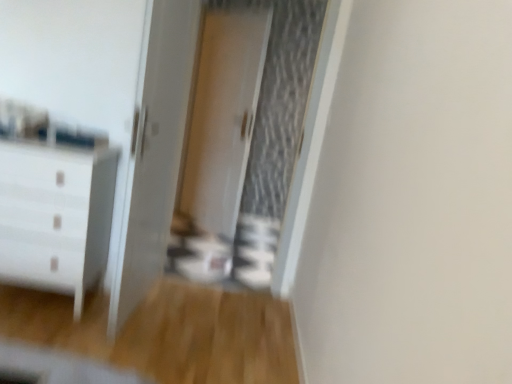
Describe the element at coordinates (245, 140) in the screenshot. I see `white glossy screen door at center, the first screen door in the front-to-back sequence` at that location.

What do you see at coordinates (55, 217) in the screenshot? I see `white glossy chest of drawers at left` at bounding box center [55, 217].

This screenshot has height=384, width=512. What are the coordinates of `white glossy door at center` in the screenshot? It's located at (152, 154).

In order to face white glossy door at center, the first screen door positioned from the back, should I rotate leftwards or rightwards?

You should rotate left by 5.209 degrees.

This screenshot has width=512, height=384. What are the coordinates of `white glossy screen door at center, the first screen door in the front-to-back sequence` in the screenshot? It's located at (245, 140).

Based on the photo, is white glossy chest of drawers at left in front of white glossy door at center?

No.

Does white glossy chest of drawers at left turn towards white glossy door at center?

No, white glossy chest of drawers at left is not turned towards white glossy door at center.

Can you confirm if white glossy chest of drawers at left is bigger than white glossy door at center?

Yes.

From the image's perspective, does white glossy chest of drawers at left appear higher than white glossy door at center?

Incorrect, from the image's perspective, white glossy chest of drawers at left is lower than white glossy door at center.

Can you see white glossy door at center touching white glossy door at center, the 2th screen door viewed from the front?

No, white glossy door at center is not touching white glossy door at center, the 2th screen door viewed from the front.

From a real-world perspective, is white glossy door at center physically above white glossy door at center, the first screen door positioned from the back?

No, from a real-world perspective, white glossy door at center is not over white glossy door at center, the first screen door positioned from the back

Considering the points (174, 134) and (213, 59), which point is behind, point (174, 134) or point (213, 59)?

The point (213, 59) is farther.

How much distance is there between white glossy door at center and white glossy chest of drawers at left?

14.71 inches.

From a real-world perspective, is white glossy door at center over white glossy chest of drawers at left?

Yes, from a real-world perspective, white glossy door at center is above white glossy chest of drawers at left.

From the image's perspective, is white glossy door at center below white glossy chest of drawers at left?

Incorrect, from the image's perspective, white glossy door at center is higher than white glossy chest of drawers at left.

Is white glossy chest of drawers at left not close to white glossy door at center, the first screen door positioned from the back?

Yes, white glossy chest of drawers at left is far from white glossy door at center, the first screen door positioned from the back.

Identify the location of the chest of drawers below the white glossy door at center, the first screen door positioned from the back (from the image's perspective). The width and height of the screenshot is (512, 384). (55, 217).

How far apart are white glossy chest of drawers at left and white glossy door at center, the 2th screen door viewed from the front?

white glossy chest of drawers at left is 5.95 feet away from white glossy door at center, the 2th screen door viewed from the front.

From the image's perspective, does white glossy chest of drawers at left appear higher than white glossy door at center, the first screen door positioned from the back?

Actually, white glossy chest of drawers at left appears below white glossy door at center, the first screen door positioned from the back, in the image.

From the picture: Considering the relative positions of white glossy chest of drawers at left and white glossy screen door at center, the second screen door when ordered from back to front, in the image provided, is white glossy chest of drawers at left to the right of white glossy screen door at center, the second screen door when ordered from back to front, from the viewer's perspective?

No, white glossy chest of drawers at left is not to the right of white glossy screen door at center, the second screen door when ordered from back to front.

Is white glossy chest of drawers at left positioned with its back to white glossy screen door at center, the first screen door in the front-to-back sequence?

No, white glossy chest of drawers at left's orientation is not away from white glossy screen door at center, the first screen door in the front-to-back sequence.

Consider the image. How different are the orientations of white glossy chest of drawers at left and white glossy screen door at center, the second screen door when ordered from back to front, in degrees?

0.863 degrees separate the facing orientations of white glossy chest of drawers at left and white glossy screen door at center, the second screen door when ordered from back to front.

Considering the sizes of objects white glossy chest of drawers at left and white glossy screen door at center, the second screen door when ordered from back to front, in the image provided, who is thinner, white glossy chest of drawers at left or white glossy screen door at center, the second screen door when ordered from back to front,?

Thinner between the two is white glossy screen door at center, the second screen door when ordered from back to front.

Is white glossy screen door at center, the second screen door when ordered from back to front, at the right side of white glossy door at center?

Indeed, white glossy screen door at center, the second screen door when ordered from back to front, is positioned on the right side of white glossy door at center.

Is white glossy screen door at center, the first screen door in the front-to-back sequence, positioned in front of white glossy door at center?

That is False.

Considering the relative sizes of white glossy screen door at center, the first screen door in the front-to-back sequence, and white glossy door at center in the image provided, is white glossy screen door at center, the first screen door in the front-to-back sequence, smaller than white glossy door at center?

No, white glossy screen door at center, the first screen door in the front-to-back sequence, is not smaller than white glossy door at center.

Based on the photo, which point is more forward, (253,38) or (162,14)?

Point (162,14)

Is white glossy door at center, the first screen door positioned from the back, placed right next to white glossy door at center?

No, white glossy door at center, the first screen door positioned from the back, is not with white glossy door at center.

From a real-world perspective, is white glossy door at center, the 2th screen door viewed from the front, above or below white glossy door at center?

From a real-world perspective, white glossy door at center, the 2th screen door viewed from the front, is physically above white glossy door at center.

What are the coordinates of `door that is above the white glossy chest of drawers at left (from the image's perspective)` in the screenshot? It's located at (152, 154).

This screenshot has height=384, width=512. I want to click on door on the left of the white glossy door at center, the first screen door positioned from the back, so click(x=152, y=154).

When comparing their distances from white glossy chest of drawers at left, does white glossy screen door at center, the second screen door when ordered from back to front, or white glossy door at center seem further?

Result: white glossy screen door at center, the second screen door when ordered from back to front.

From the image, which object appears to be nearer to white glossy screen door at center, the second screen door when ordered from back to front, white glossy door at center, the 2th screen door viewed from the front, or white glossy chest of drawers at left?

white glossy door at center, the 2th screen door viewed from the front, is closer to white glossy screen door at center, the second screen door when ordered from back to front.

In the scene shown: Estimate the real-world distances between objects in this image. Which object is closer to white glossy chest of drawers at left, white glossy screen door at center, the second screen door when ordered from back to front, or white glossy door at center, the first screen door positioned from the back?

white glossy screen door at center, the second screen door when ordered from back to front.

Estimate the real-world distances between objects in this image. Which object is further from white glossy chest of drawers at left, white glossy door at center, the 2th screen door viewed from the front, or white glossy door at center?

white glossy door at center, the 2th screen door viewed from the front, is positioned further to the anchor white glossy chest of drawers at left.

Considering their positions, is white glossy door at center positioned closer to white glossy door at center, the first screen door positioned from the back, than white glossy screen door at center, the first screen door in the front-to-back sequence?

white glossy screen door at center, the first screen door in the front-to-back sequence.

Which object lies nearer to the anchor point white glossy screen door at center, the second screen door when ordered from back to front, white glossy door at center or white glossy chest of drawers at left?

white glossy door at center.

Looking at the image, which one is located further to white glossy screen door at center, the second screen door when ordered from back to front, white glossy door at center, the first screen door positioned from the back, or white glossy door at center?

Based on the image, white glossy door at center appears to be further to white glossy screen door at center, the second screen door when ordered from back to front.

Estimate the real-world distances between objects in this image. Which object is further from white glossy door at center, the 2th screen door viewed from the front, white glossy chest of drawers at left or white glossy screen door at center, the second screen door when ordered from back to front?

The object further to white glossy door at center, the 2th screen door viewed from the front, is white glossy chest of drawers at left.

What are the coordinates of `chest of drawers between white glossy door at center and white glossy door at center, the 2th screen door viewed from the front, along the z-axis` in the screenshot? It's located at (55, 217).

Where is `door between white glossy chest of drawers at left and white glossy screen door at center, the second screen door when ordered from back to front`? The width and height of the screenshot is (512, 384). door between white glossy chest of drawers at left and white glossy screen door at center, the second screen door when ordered from back to front is located at coordinates (152, 154).

Identify the location of screen door between white glossy chest of drawers at left and white glossy door at center, the 2th screen door viewed from the front, along the z-axis. (245, 140).

Where is `screen door located between white glossy door at center and white glossy door at center, the 2th screen door viewed from the front, in the depth direction`? The image size is (512, 384). screen door located between white glossy door at center and white glossy door at center, the 2th screen door viewed from the front, in the depth direction is located at coordinates (245, 140).